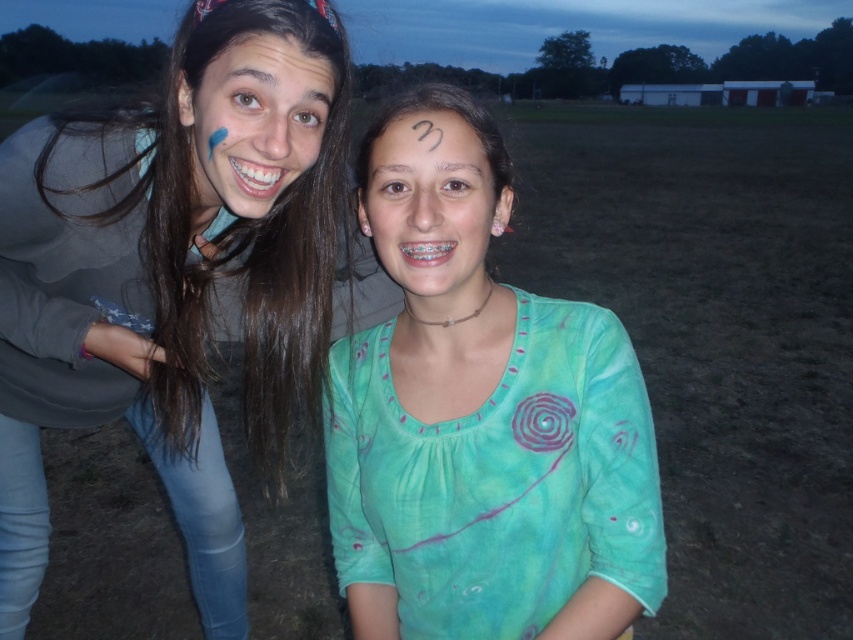
How far apart are matte green shirt at center and smooth skin forehead at center?

matte green shirt at center and smooth skin forehead at center are 2.28 inches apart.

Find the location of `matte green shirt at center`. matte green shirt at center is located at coordinates (432, 205).

Who is more distant from viewer, (416, 115) or (407, 102)?

The point (407, 102) is more distant.

At what (x,y) coordinates should I click in order to perform the action: click on matte green shirt at center. Please return your answer as a coordinate pair (x, y). Looking at the image, I should click on (432, 205).

Which of these two, matte gray sweatshirt at left or matte blue paint at left, stands shorter?

matte blue paint at left is shorter.

Does matte gray sweatshirt at left appear under matte blue paint at left?

Indeed, matte gray sweatshirt at left is positioned under matte blue paint at left.

Who is more forward, (276, 321) or (299, 132)?

Point (299, 132) is in front.

Find the location of `matte gray sweatshirt at left`. matte gray sweatshirt at left is located at coordinates (177, 275).

Can you confirm if matte blue paint at left is positioned to the right of smooth skin forehead at center?

In fact, matte blue paint at left is to the left of smooth skin forehead at center.

Is point (222, 193) more distant than point (489, 156)?

Yes, point (222, 193) is behind point (489, 156).

The image size is (853, 640). Identify the location of matte blue paint at left. (254, 122).